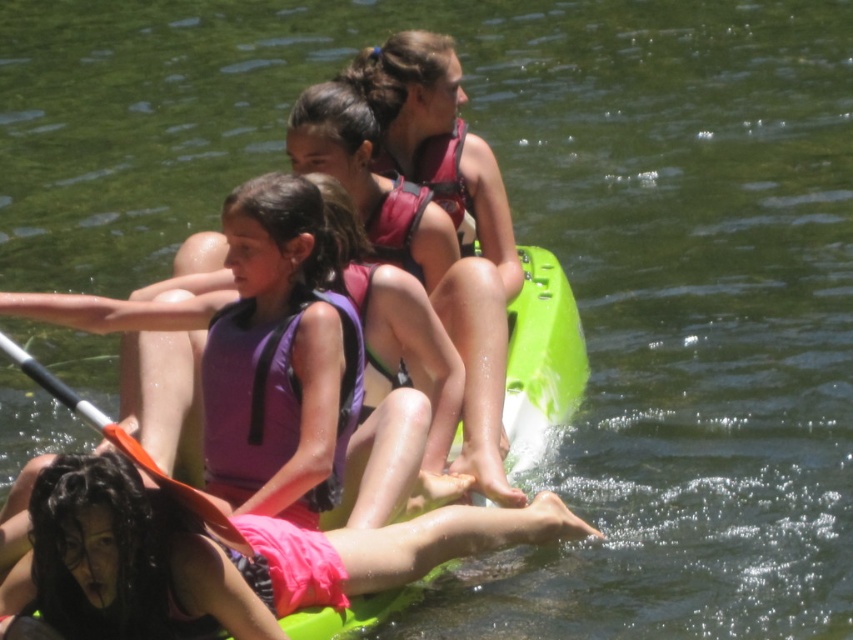
You are taking a photo of the scene and want to focus on both point (207, 563) and point (456, 173). Which point should you focus on first to ensure both are in sharp focus?

You should focus on point (207, 563) first because it is closer to the camera than point (456, 173). By focusing on the closer point, the farther point will also be in focus if within the depth of field.

You are planning to store the pink fabric life vest at lower center and the orange paddle at center in a storage compartment. The compartment has a maximum width capacity of 40 cm. According to the objects in the scene, will both items fit side by side in the compartment?

The pink fabric life vest at lower center is wider than the orange paddle at center. Since the life vest is wider, and the compartment can only hold up to 40 cm, we need to know the exact widths to determine if they fit. However, the description only states the life vest is wider, not the exact measurements. Therefore, it is uncertain if both will fit without additional information.